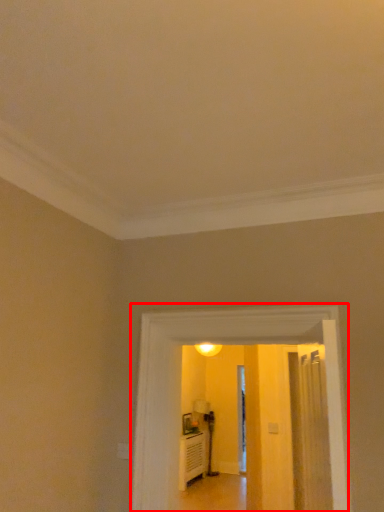
Question: From the image's perspective, where is corridor (annotated by the red box) located relative to path?

Choices:
 (A) below
 (B) above

Answer: (B)